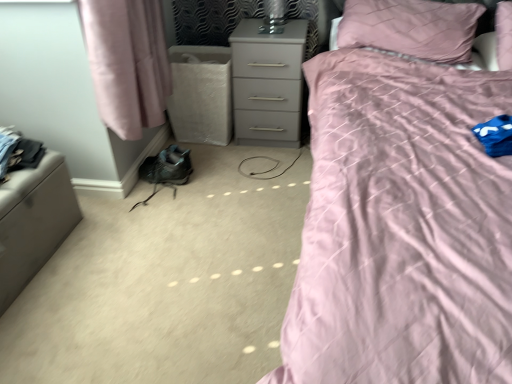
Identify the location of matte gray nightstand at center. (267, 83).

Image resolution: width=512 pixels, height=384 pixels. Describe the element at coordinates (402, 208) in the screenshot. I see `matte pink quilt at upper right` at that location.

The image size is (512, 384). Describe the element at coordinates (411, 28) in the screenshot. I see `pink quilted pillow at upper right` at that location.

At what (x,y) coordinates should I click in order to perform the action: click on pink quilted pillow at upper right. Please return your answer as a coordinate pair (x, y). Image resolution: width=512 pixels, height=384 pixels. Looking at the image, I should click on (411, 28).

The width and height of the screenshot is (512, 384). In order to click on matte gray nightstand at center in this screenshot , I will do `click(267, 83)`.

Is satin gray ottoman at left touching matte gray nightstand at center?

No, satin gray ottoman at left is not beside matte gray nightstand at center.

Is the position of satin gray ottoman at left more distant than that of matte gray nightstand at center?

No.

Is satin gray ottoman at left to the right of matte gray nightstand at center from the viewer's perspective?

In fact, satin gray ottoman at left is to the left of matte gray nightstand at center.

Which point is more distant from viewer, (461, 121) or (76, 201)?

The point (76, 201) is behind.

Image resolution: width=512 pixels, height=384 pixels. Find the location of `furniture behind the matte pink quilt at upper right`. furniture behind the matte pink quilt at upper right is located at coordinates (33, 221).

Would you say matte pink quilt at upper right is inside or outside satin gray ottoman at left?

matte pink quilt at upper right is outside satin gray ottoman at left.

Is matte pink quilt at upper right oriented towards pink quilted pillow at upper right?

No.

Does point (380, 312) appear closer or farther from the camera than point (482, 8)?

Point (380, 312) is closer to the camera than point (482, 8).

From a real-world perspective, does matte pink quilt at upper right stand above pink quilted pillow at upper right?

No, from a real-world perspective, matte pink quilt at upper right is not over pink quilted pillow at upper right

From a real-world perspective, is pink quilted pillow at upper right located higher than matte gray nightstand at center?

Yes, from a real-world perspective, pink quilted pillow at upper right is above matte gray nightstand at center.

Is pink quilted pillow at upper right not inside matte gray nightstand at center?

Yes.

Who is shorter, pink quilted pillow at upper right or matte gray nightstand at center?

pink quilted pillow at upper right.

From the image's perspective, between pink quilted pillow at upper right and matte gray nightstand at center, who is located below?

From the image's view, matte gray nightstand at center is below.

Is pink quilted pillow at upper right in front of or behind dark gray fabric at left in the image?

pink quilted pillow at upper right is positioned farther from the viewer than dark gray fabric at left.

From the picture: Can you confirm if pink quilted pillow at upper right is thinner than dark gray fabric at left?

No.

Is point (345, 19) behind point (7, 155)?

Yes, it is behind point (7, 155).

Who is shorter, satin gray ottoman at left or matte pink quilt at upper right?

satin gray ottoman at left.

From a real-world perspective, is satin gray ottoman at left under matte pink quilt at upper right?

Yes, from a real-world perspective, satin gray ottoman at left is beneath matte pink quilt at upper right.

Which object is positioned more to the left, satin gray ottoman at left or matte pink quilt at upper right?

satin gray ottoman at left is more to the left.

Considering the sizes of objects satin gray ottoman at left and matte pink quilt at upper right in the image provided, who is bigger, satin gray ottoman at left or matte pink quilt at upper right?

matte pink quilt at upper right is bigger.

In order to click on clothing in front of the pink quilted pillow at upper right in this screenshot , I will do `click(18, 151)`.

In the scene shown: Does dark gray fabric at left appear on the right side of pink quilted pillow at upper right?

No.

Is dark gray fabric at left taller or shorter than pink quilted pillow at upper right?

Considering their sizes, dark gray fabric at left has less height than pink quilted pillow at upper right.

Where is `nightstand lying above the satin gray ottoman at left (from the image's perspective)`? nightstand lying above the satin gray ottoman at left (from the image's perspective) is located at coordinates (267, 83).

There is a satin gray ottoman at left. Where is `bed above it (from a real-world perspective)`? This screenshot has width=512, height=384. bed above it (from a real-world perspective) is located at coordinates (402, 208).

Which object lies nearer to the anchor point dark gray fabric at left, satin gray ottoman at left or matte gray nightstand at center?

The object closer to dark gray fabric at left is satin gray ottoman at left.

Looking at the image, which one is located further to matte gray nightstand at center, dark gray fabric at left or pink quilted pillow at upper right?

dark gray fabric at left is further to matte gray nightstand at center.

Which object lies further to the anchor point dark gray fabric at left, matte pink quilt at upper right or satin gray ottoman at left?

matte pink quilt at upper right lies further to dark gray fabric at left than the other object.

Based on their spatial positions, is satin gray ottoman at left or dark gray fabric at left closer to matte pink quilt at upper right?

satin gray ottoman at left lies closer to matte pink quilt at upper right than the other object.

Looking at the image, which one is located further to dark gray fabric at left, pink quilted pillow at upper right or matte pink quilt at upper right?

Among the two, pink quilted pillow at upper right is located further to dark gray fabric at left.

Looking at the image, which one is located further to satin gray ottoman at left, matte pink quilt at upper right or matte gray nightstand at center?

The object further to satin gray ottoman at left is matte pink quilt at upper right.

Based on their spatial positions, is matte gray nightstand at center or matte pink quilt at upper right further from pink quilted pillow at upper right?

Among the two, matte gray nightstand at center is located further to pink quilted pillow at upper right.

Based on their spatial positions, is matte pink quilt at upper right or dark gray fabric at left further from satin gray ottoman at left?

The object further to satin gray ottoman at left is matte pink quilt at upper right.

Locate an element on the screen. This screenshot has width=512, height=384. nightstand between dark gray fabric at left and pink quilted pillow at upper right from left to right is located at coordinates (267, 83).

Locate an element on the screen. The image size is (512, 384). nightstand situated between satin gray ottoman at left and pink quilted pillow at upper right from left to right is located at coordinates (267, 83).

What are the coordinates of `pillow between matte pink quilt at upper right and matte gray nightstand at center along the z-axis` in the screenshot? It's located at (411, 28).

At what (x,y) coordinates should I click in order to perform the action: click on clothing between satin gray ottoman at left and pink quilted pillow at upper right in the horizontal direction. Please return your answer as a coordinate pair (x, y). This screenshot has width=512, height=384. Looking at the image, I should click on (18, 151).